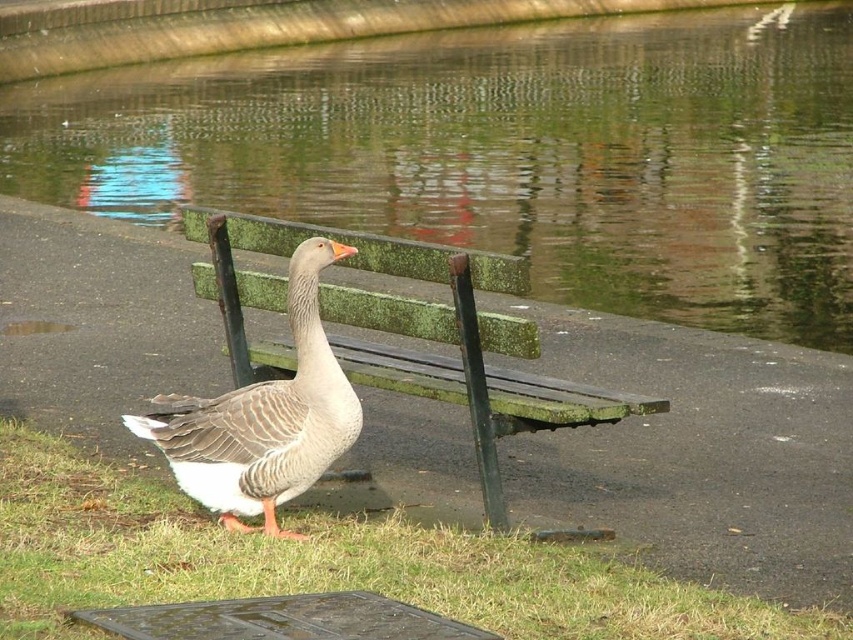
Between greenish water at bench right and green mossy bench at center, which one is positioned lower?

Positioned lower is green mossy bench at center.

Can you confirm if greenish water at bench right is positioned below green mossy bench at center?

No.

Who is more forward, (144, 90) or (399, 321)?

Positioned in front is point (399, 321).

Where is `greenish water at bench right`? The image size is (853, 640). greenish water at bench right is located at coordinates (508, 154).

Who is taller, greenish water at bench right or gray matte duck at center?

greenish water at bench right is taller.

From the picture: How far apart are greenish water at bench right and gray matte duck at center?

They are 9.32 meters apart.

Is point (608, 83) farther from camera compared to point (289, 461)?

Yes, it is behind point (289, 461).

This screenshot has width=853, height=640. I want to click on greenish water at bench right, so (x=508, y=154).

You are a GUI agent. You are given a task and a screenshot of the screen. Output one action in this format:
    pyautogui.click(x=<x>, y=<y>)
    Task: Click on the greenish water at bench right
    This screenshot has width=853, height=640.
    Given the screenshot: What is the action you would take?
    pos(508,154)

Can you confirm if greenish water at bench right is positioned to the right of green grass at lower left?

Yes, greenish water at bench right is to the right of green grass at lower left.

You are a GUI agent. You are given a task and a screenshot of the screen. Output one action in this format:
    pyautogui.click(x=<x>, y=<y>)
    Task: Click on the greenish water at bench right
    This screenshot has width=853, height=640.
    Given the screenshot: What is the action you would take?
    pyautogui.click(x=508, y=154)

Identify the location of greenish water at bench right. (508, 154).